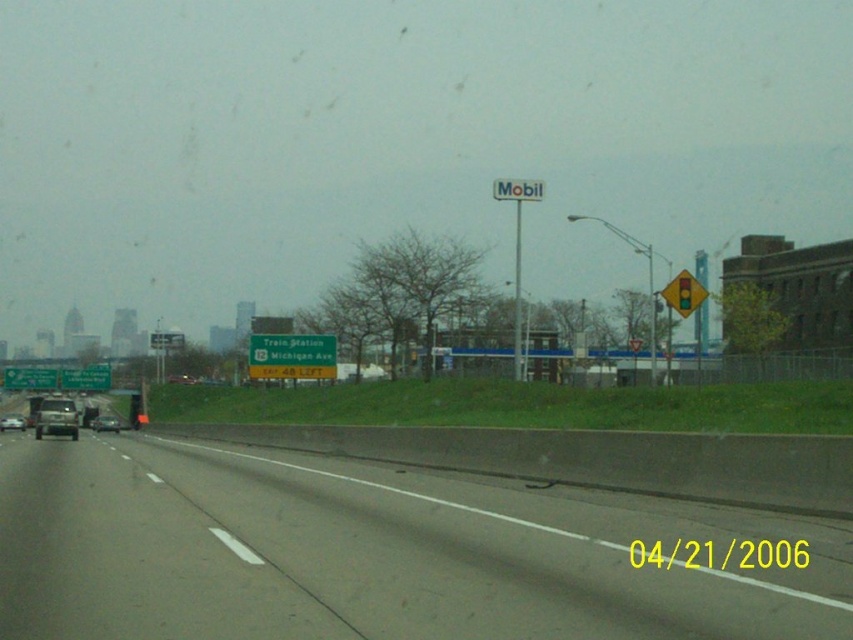
You are a passenger in a car looking out the window. You notice the gray asphalt highway at center and the transparent glass windshield at left. Which object is closer to you?

The transparent glass windshield at left is closer to you because it is positioned under the gray asphalt highway at center.